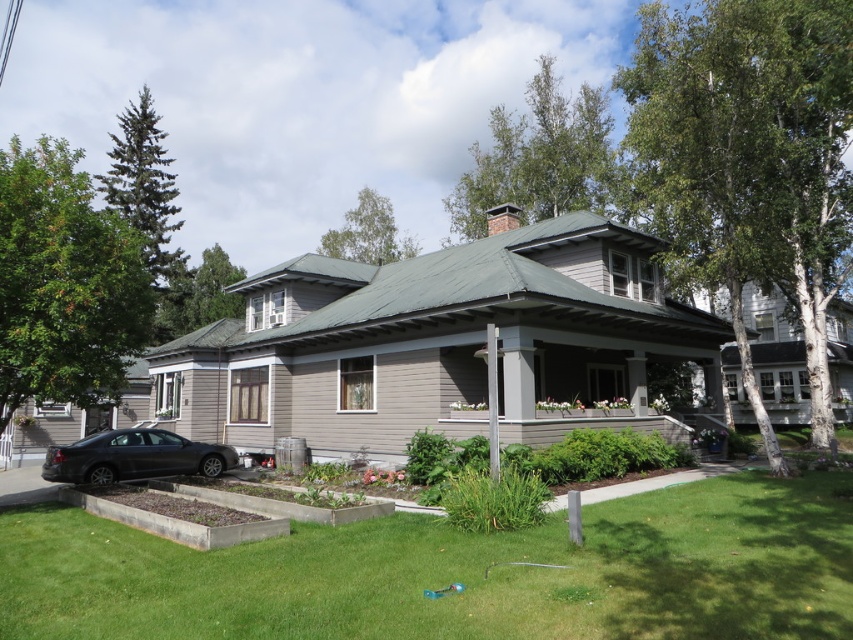
Is green grass at lower center to the left of matte black car at lower left from the viewer's perspective?

In fact, green grass at lower center is to the right of matte black car at lower left.

Who is positioned more to the left, green grass at lower center or matte black car at lower left?

matte black car at lower left is more to the left.

Locate an element on the screen. This screenshot has height=640, width=853. green grass at lower center is located at coordinates (457, 572).